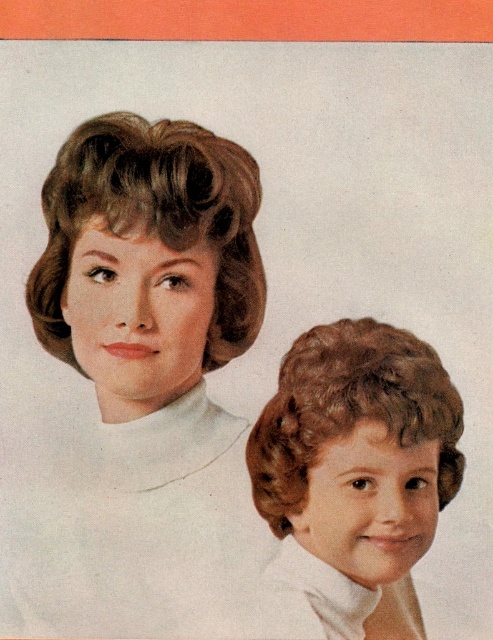
Looking at the image, there are two brown hair styles present. The first is the matte brown hair at upper left and the second is the shiny brown hair at lower right. Which of these two brown hair styles is positioned more to the left side of the image?

The matte brown hair at upper left is positioned to the left of the shiny brown hair at lower right, so the matte brown hair at upper left is more to the left side of the image.

You are a photographer standing 1.5 meters away from the scene. You want to take a closeup shot of the matte brown hair at upper left. Can you reach it with your camera without moving closer?

The matte brown hair at upper left is 1.11 meters away from the viewer. Since you are 1.5 meters away, you are 0.39 meters farther than the required distance. Therefore, you cannot reach it without moving closer.